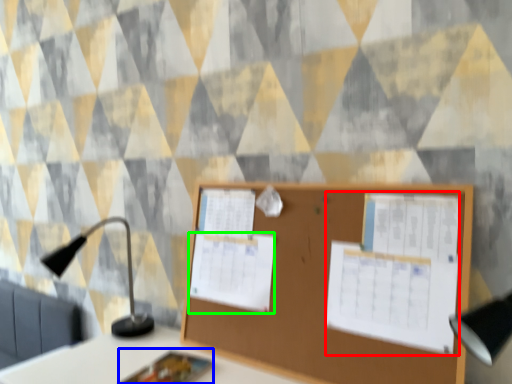
Question: Which object is the farthest from poster (highlighted by a red box)? Choose among these: notebook (highlighted by a blue box) or poster (highlighted by a green box).

Choices:
 (A) notebook
 (B) poster

Answer: (A)